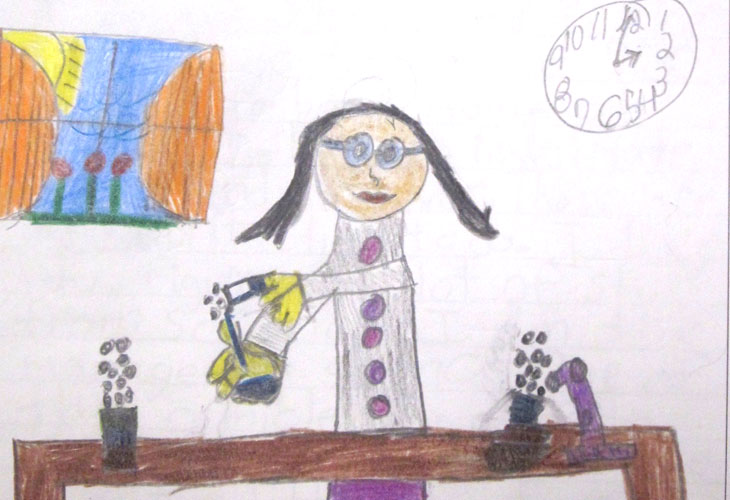
The width and height of the screenshot is (730, 500). I want to click on table drawing, so click(269, 455).